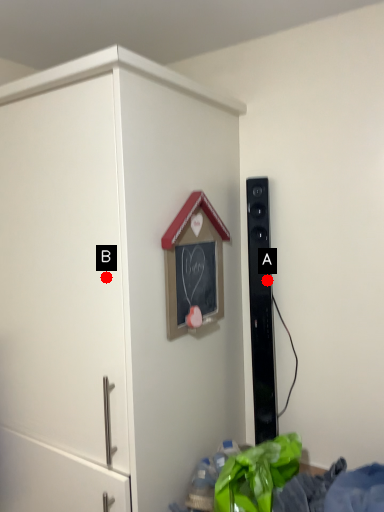
Question: Two points are circled on the image, labeled by A and B beside each circle. Which point is closer to the camera taking this photo?

Choices:
 (A) A is closer
 (B) B is closer

Answer: (B)